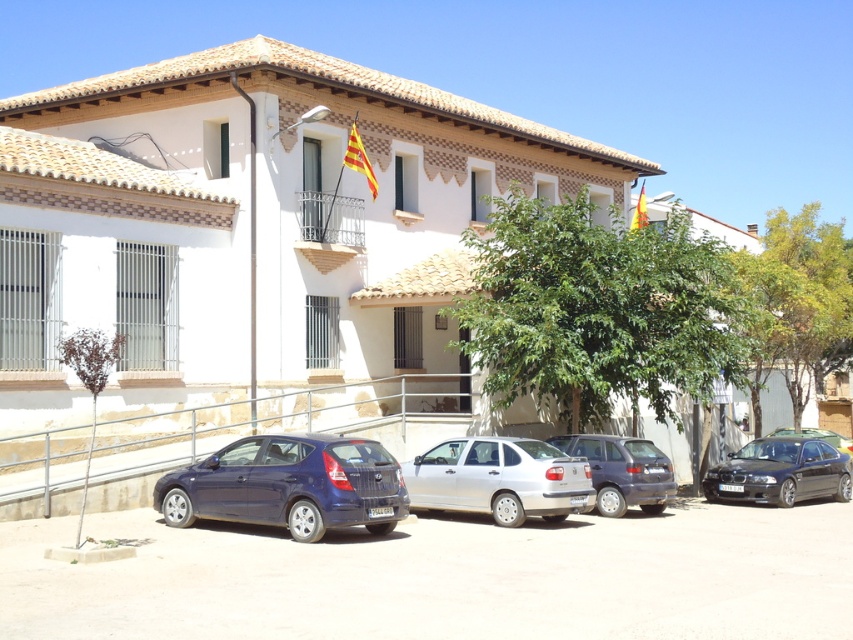
You are a delivery driver who needs to park your truck, which is 2 meters wide, in the parking area shown in the image. The parking spot is between the satin blue hatchback at lower left and the brown textured tree at lower left. Can your truck fit between them?

The satin blue hatchback at lower left might be wider than the brown textured tree at lower left, but since the exact width difference isn not specified, it is uncertain whether the truck can fit. Please check the actual space before attempting to park.